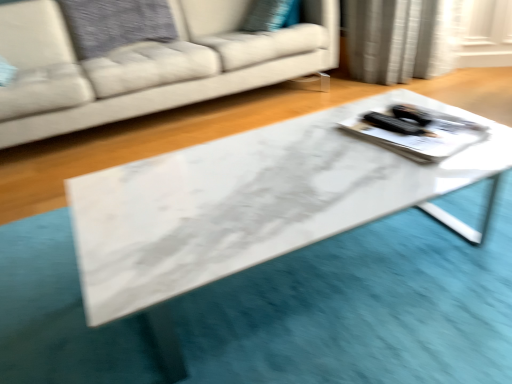
This screenshot has height=384, width=512. In order to click on vacant space positioned to the left of white glossy tray at center in this screenshot , I will do `click(311, 151)`.